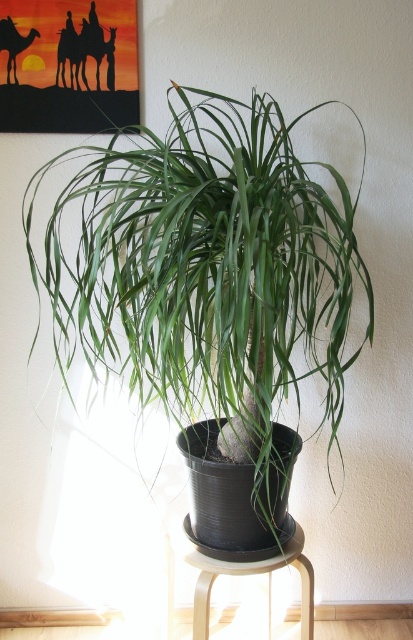
You are a painter who wants to hang a new painting that is 1.5 meters tall on the wall. The wooden stool at lower center is currently under the potted plant. Do you think the matte black camel at upper left will interfere with hanging the new painting?

The wooden stool at lower center is much taller than the matte black camel at upper left, so the stool might block access to the wall where the matte black camel at upper left is located. Therefore, moving the stool could be necessary to hang the new painting without interference.

You are a gardener who needs to move the green matte plant at center and the wooden stool at lower center to another room. Which object should you move first to ensure the other remains stable?

You should move the wooden stool at lower center first because the green matte plant at center is positioned over it. If you move the plant first, the stool might become unstable without it.

You are a delivery person who needs to place a package between the wooden stool at lower center and the matte black camel at upper left. The package requires 3.5 feet of space. Can you fit it there?

The wooden stool at lower center and matte black camel at upper left are 4.13 feet apart, so yes, the package requiring 3.5 feet of space can fit between them since the distance is sufficient.